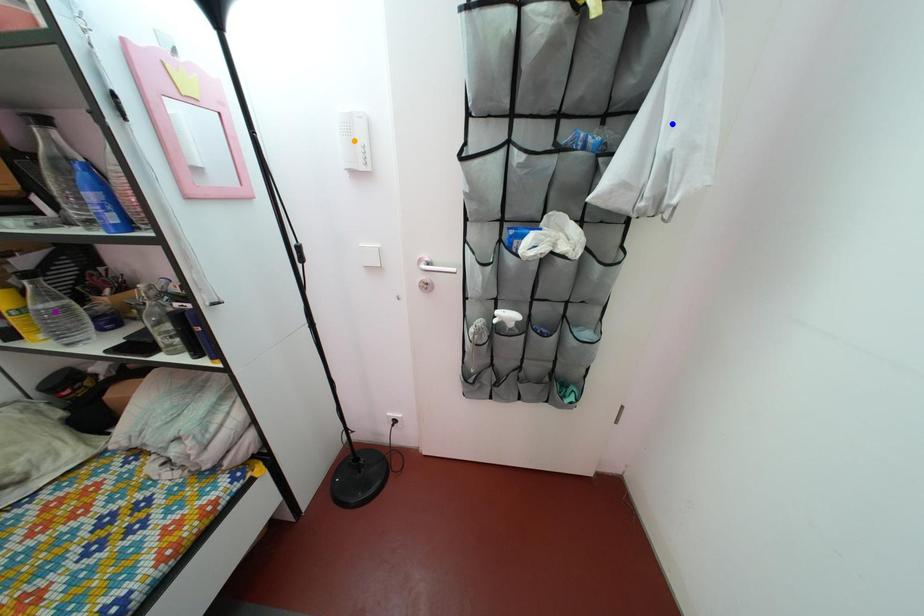
Order these from nearest to farthest:
purple point, blue point, orange point

blue point
orange point
purple point